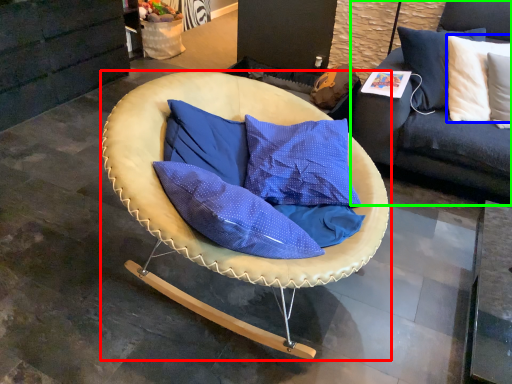
Question: Which object is the closest to the chair (highlighted by a red box)? Choose among these: pillow (highlighted by a blue box) or studio couch (highlighted by a green box).

Choices:
 (A) pillow
 (B) studio couch

Answer: (B)